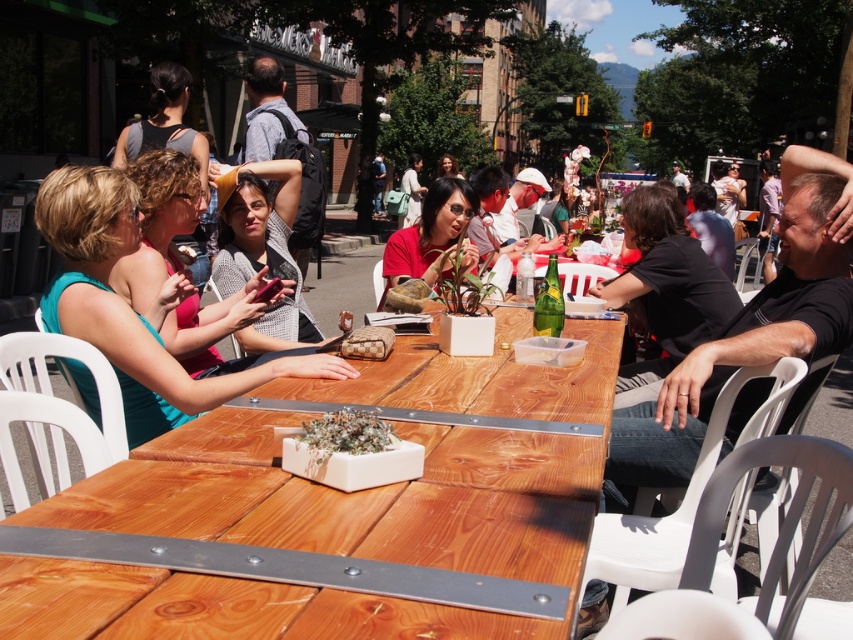
Is black matte shirt at right closer to the viewer compared to matte red shirt at center?

Yes, black matte shirt at right is closer to the viewer.

Does black matte shirt at right appear over matte red shirt at center?

No.

Does point (795, 232) come behind point (457, 195)?

No, it is not.

The height and width of the screenshot is (640, 853). What are the coordinates of `black matte shirt at right` in the screenshot? It's located at tap(741, 346).

At what (x,y) coordinates should I click in order to perform the action: click on black matte shirt at upper right. Please return your answer as a coordinate pair (x, y). The image size is (853, 640). Looking at the image, I should click on (665, 289).

How much distance is there between knitted gray sweater at center and white matte planter at center?

knitted gray sweater at center and white matte planter at center are 6.53 feet apart.

Is point (274, 209) less distant than point (392, 449)?

No, (274, 209) is further to viewer.

The height and width of the screenshot is (640, 853). Identify the location of knitted gray sweater at center. (264, 252).